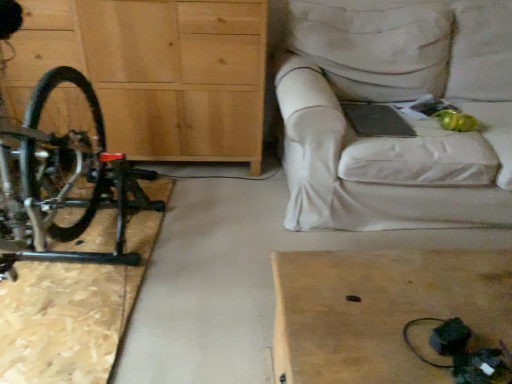
In order to face wooden chest of drawers at left, should I rotate leftwards or rightwards?

It's best to rotate left around 18.293 degrees.

Image resolution: width=512 pixels, height=384 pixels. In order to click on white fabric couch at upper right in this screenshot , I will do `click(396, 101)`.

From the image's perspective, is black matte bicycle at left located above or below wooden chest of drawers at left?

Clearly, from the image's perspective, black matte bicycle at left is below wooden chest of drawers at left.

Is black matte bicycle at left bigger than wooden chest of drawers at left?

Yes, black matte bicycle at left is bigger than wooden chest of drawers at left.

Considering the positions of objects black matte bicycle at left and wooden chest of drawers at left in the image provided, who is more to the left, black matte bicycle at left or wooden chest of drawers at left?

From the viewer's perspective, black matte bicycle at left appears more on the left side.

Is point (99, 170) closer or farther from the camera than point (20, 92)?

Point (99, 170) is positioned closer to the camera compared to point (20, 92).

Find the location of `the chest of drawers that is behind the white fabric couch at upper right`. the chest of drawers that is behind the white fabric couch at upper right is located at coordinates (158, 71).

Considering the positions of points (382, 148) and (156, 30), is point (382, 148) farther from camera compared to point (156, 30)?

That is False.

Is white fabric couch at upper right oriented towards wooden chest of drawers at left?

No, white fabric couch at upper right is not turned towards wooden chest of drawers at left.

Considering the relative sizes of white fabric couch at upper right and wooden chest of drawers at left in the image provided, is white fabric couch at upper right thinner than wooden chest of drawers at left?

Incorrect, the width of white fabric couch at upper right is not less than that of wooden chest of drawers at left.

Considering the relative sizes of light brown wooden table at lower right and wooden chest of drawers at left in the image provided, is light brown wooden table at lower right smaller than wooden chest of drawers at left?

Correct, light brown wooden table at lower right occupies less space than wooden chest of drawers at left.

Which is behind, light brown wooden table at lower right or wooden chest of drawers at left?

Positioned behind is wooden chest of drawers at left.

How far apart are light brown wooden table at lower right and wooden chest of drawers at left?

light brown wooden table at lower right is 4.17 feet away from wooden chest of drawers at left.

Between light brown wooden table at lower right and wooden chest of drawers at left, which one has smaller width?

light brown wooden table at lower right.

From the picture: Considering the sizes of objects wooden chest of drawers at left and black matte bicycle at left in the image provided, who is wider, wooden chest of drawers at left or black matte bicycle at left?

Wider between the two is black matte bicycle at left.

Does wooden chest of drawers at left appear on the left side of black matte bicycle at left?

No, wooden chest of drawers at left is not to the left of black matte bicycle at left.

Which of these two, wooden chest of drawers at left or black matte bicycle at left, stands shorter?

wooden chest of drawers at left.

Considering the positions of point (306, 154) and point (93, 163), is point (306, 154) closer or farther from the camera than point (93, 163)?

Point (306, 154) is farther from the camera than point (93, 163).

Is the surface of white fabric couch at upper right in direct contact with black matte bicycle at left?

white fabric couch at upper right and black matte bicycle at left are clearly separated.

Considering the positions of objects white fabric couch at upper right and black matte bicycle at left in the image provided, who is more to the right, white fabric couch at upper right or black matte bicycle at left?

white fabric couch at upper right.

Considering the relative sizes of white fabric couch at upper right and black matte bicycle at left in the image provided, is white fabric couch at upper right taller than black matte bicycle at left?

No.

Between white fabric couch at upper right and light brown wooden table at lower right, which one has larger width?

white fabric couch at upper right is wider.

Who is taller, white fabric couch at upper right or light brown wooden table at lower right?

white fabric couch at upper right.

From the image's perspective, does white fabric couch at upper right appear higher than light brown wooden table at lower right?

Yes, from the image's perspective, white fabric couch at upper right is on top of light brown wooden table at lower right.

What are the coordinates of `studio couch on the right of wooden chest of drawers at left` in the screenshot? It's located at (396, 101).

In the image, is wooden chest of drawers at left positioned in front of or behind white fabric couch at upper right?

Visually, wooden chest of drawers at left is located behind white fabric couch at upper right.

Does wooden chest of drawers at left have a greater height compared to white fabric couch at upper right?

Yes, wooden chest of drawers at left is taller than white fabric couch at upper right.

Is wooden chest of drawers at left not within white fabric couch at upper right?

That's correct, wooden chest of drawers at left is outside of white fabric couch at upper right.

Image resolution: width=512 pixels, height=384 pixels. In order to click on bicycle that appears below the wooden chest of drawers at left (from the image's perspective) in this screenshot , I will do `click(63, 183)`.

At what (x,y) coordinates should I click in order to perform the action: click on studio couch on the right of the wooden chest of drawers at left. Please return your answer as a coordinate pair (x, y). This screenshot has width=512, height=384. Looking at the image, I should click on (396, 101).

When comparing their distances from black matte bicycle at left, does wooden chest of drawers at left or white fabric couch at upper right seem closer?

wooden chest of drawers at left is closer to black matte bicycle at left.

Considering their positions, is wooden chest of drawers at left positioned closer to black matte bicycle at left than light brown wooden table at lower right?

wooden chest of drawers at left is closer to black matte bicycle at left.

When comparing their distances from white fabric couch at upper right, does wooden chest of drawers at left or black matte bicycle at left seem closer?

The object closer to white fabric couch at upper right is wooden chest of drawers at left.

When comparing their distances from white fabric couch at upper right, does black matte bicycle at left or wooden chest of drawers at left seem further?

black matte bicycle at left.

Based on their spatial positions, is white fabric couch at upper right or wooden chest of drawers at left further from black matte bicycle at left?

white fabric couch at upper right is further to black matte bicycle at left.

Looking at the image, which one is located further to white fabric couch at upper right, light brown wooden table at lower right or wooden chest of drawers at left?

Based on the image, light brown wooden table at lower right appears to be further to white fabric couch at upper right.

Based on their spatial positions, is light brown wooden table at lower right or wooden chest of drawers at left further from black matte bicycle at left?

The object further to black matte bicycle at left is light brown wooden table at lower right.

From the image, which object appears to be nearer to wooden chest of drawers at left, white fabric couch at upper right or black matte bicycle at left?

Based on the image, black matte bicycle at left appears to be nearer to wooden chest of drawers at left.

This screenshot has width=512, height=384. Identify the location of table between wooden chest of drawers at left and white fabric couch at upper right from left to right. click(382, 310).

The image size is (512, 384). I want to click on chest of drawers between black matte bicycle at left and white fabric couch at upper right in the horizontal direction, so click(158, 71).

Identify the location of table between black matte bicycle at left and wooden chest of drawers at left along the z-axis. The height and width of the screenshot is (384, 512). (382, 310).

Where is `table between black matte bicycle at left and white fabric couch at upper right`? The width and height of the screenshot is (512, 384). table between black matte bicycle at left and white fabric couch at upper right is located at coordinates (382, 310).